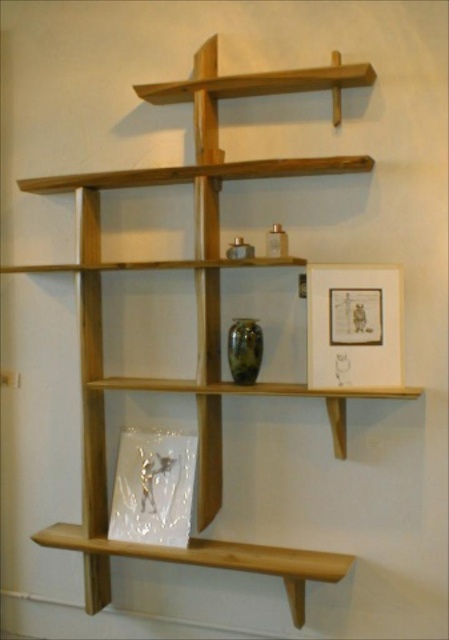
Question: Does matte white picture frame at upper right have a larger size compared to wooden shelf at lower center?

Choices:
 (A) no
 (B) yes

Answer: (A)

Question: Does matte white picture frame at upper right appear under wooden shelf at lower center?

Choices:
 (A) yes
 (B) no

Answer: (B)

Question: Which point is closer to the camera taking this photo?

Choices:
 (A) (167, 560)
 (B) (382, 324)

Answer: (B)

Question: Which point appears closest to the camera in this image?

Choices:
 (A) (333, 556)
 (B) (334, 365)

Answer: (B)

Question: Which of the following is the farthest from the observer?

Choices:
 (A) (74, 541)
 (B) (394, 349)

Answer: (A)

Question: Can you confirm if matte white picture frame at upper right is positioned to the left of wooden shelf at lower center?

Choices:
 (A) yes
 (B) no

Answer: (B)